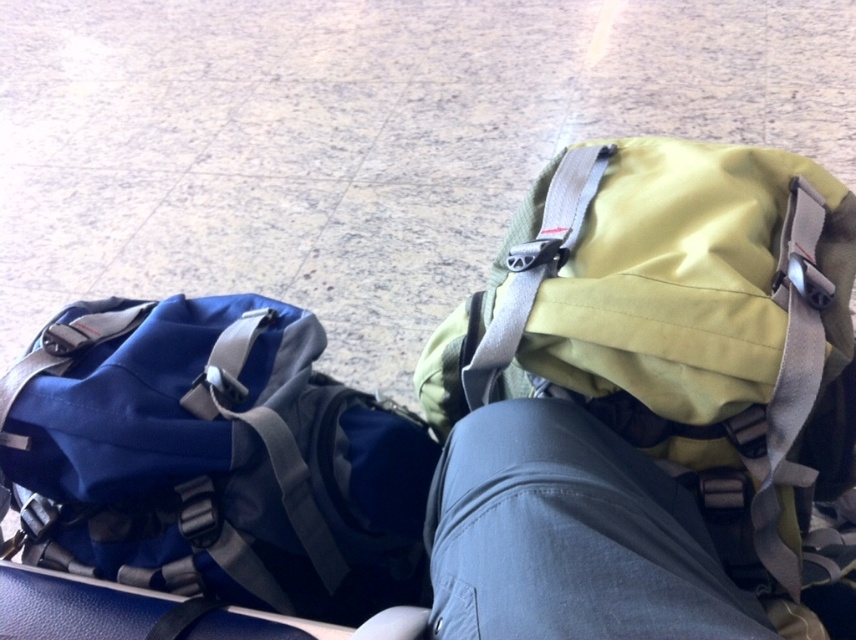
Is point (730, 355) in front of point (153, 305)?

Yes, it is in front of point (153, 305).

Between matte green backpack at upper right and matte blue backpack at left, which one has more height?

With more height is matte green backpack at upper right.

Find the location of `matte green backpack at upper right`. matte green backpack at upper right is located at coordinates coord(681,340).

Who is lower down, matte green backpack at upper right or gray fabric strap at upper center?

matte green backpack at upper right is below.

Does matte green backpack at upper right appear over gray fabric strap at upper center?

No.

Locate an element on the screen. The width and height of the screenshot is (856, 640). matte green backpack at upper right is located at coordinates (681, 340).

Does point (432, 461) come behind point (519, 336)?

Yes, point (432, 461) is farther from viewer.

Is matte blue backpack at left smaller than gray fabric strap at upper center?

No, matte blue backpack at left is not smaller than gray fabric strap at upper center.

The width and height of the screenshot is (856, 640). Find the location of `matte blue backpack at left`. matte blue backpack at left is located at coordinates (214, 460).

The width and height of the screenshot is (856, 640). I want to click on matte blue backpack at left, so click(214, 460).